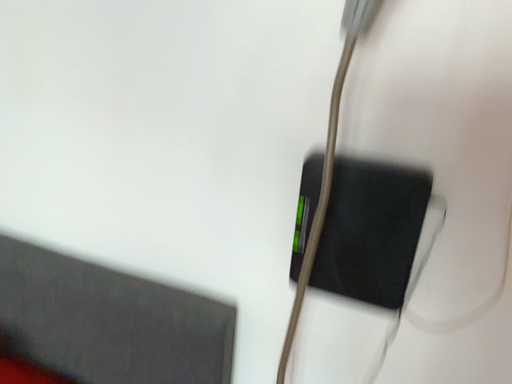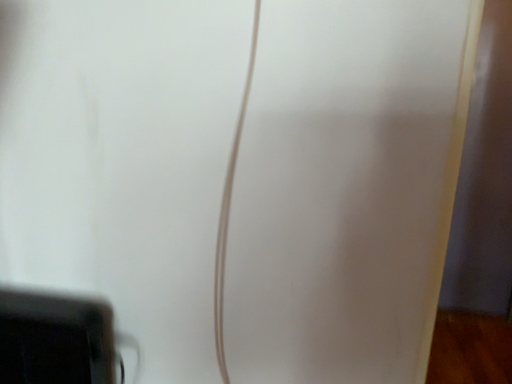
Question: Which way did the camera rotate in the video?

Choices:
 (A) rotated left
 (B) rotated right

Answer: (B)